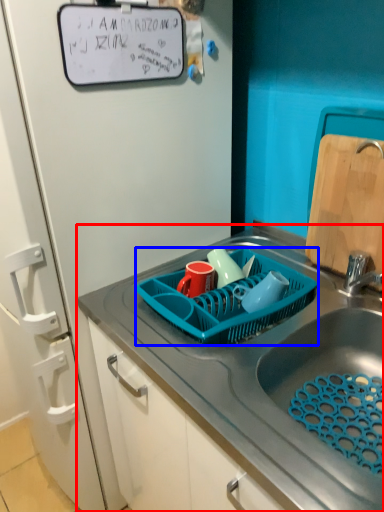
Question: Which of the following is the farthest to the observer, sink (highlighted by a red box) or basket (highlighted by a blue box)?

Choices:
 (A) sink
 (B) basket

Answer: (B)